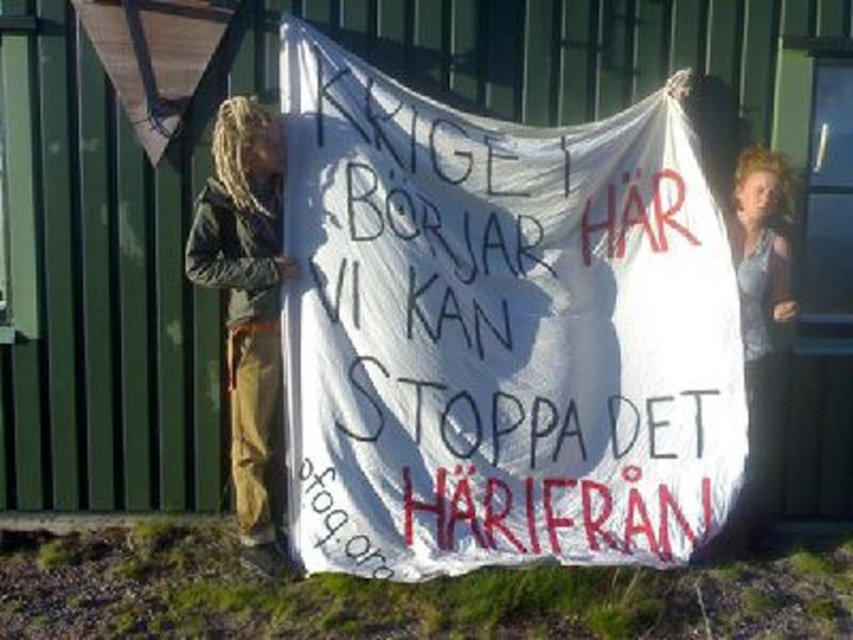
Question: Is white paper banner at center wider than blonde hair at upper right?

Choices:
 (A) yes
 (B) no

Answer: (A)

Question: Where is white paper banner at center located in relation to brown leather jacket at left in the image?

Choices:
 (A) below
 (B) above

Answer: (B)

Question: Which of these objects is positioned closest to the brown leather jacket at left?

Choices:
 (A) white paper banner at center
 (B) blonde hair at upper right

Answer: (A)

Question: Which point is farther to the camera?

Choices:
 (A) brown leather jacket at left
 (B) blonde hair at upper right

Answer: (B)

Question: In this image, where is brown leather jacket at left located relative to blonde hair at upper right?

Choices:
 (A) right
 (B) left

Answer: (B)

Question: Based on their relative distances, which object is farther from the white paper banner at center?

Choices:
 (A) blonde hair at upper right
 (B) brown leather jacket at left

Answer: (A)